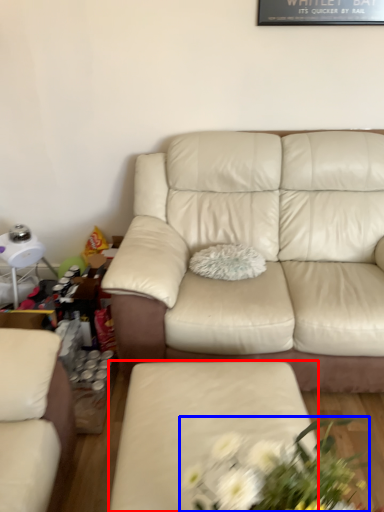
Question: Among these objects, which one is nearest to the camera, couch (highlighted by a red box) or floral arrangement (highlighted by a blue box)?

Choices:
 (A) couch
 (B) floral arrangement

Answer: (B)